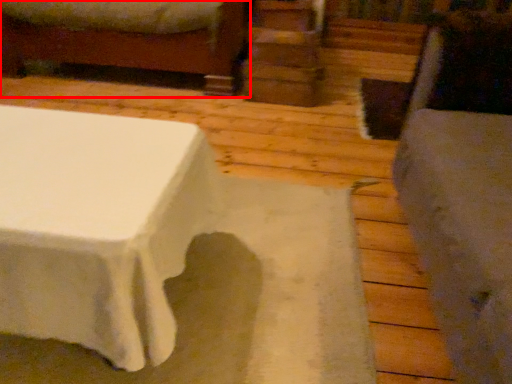
Question: From the image's perspective, where is furniture (annotated by the red box) located relative to swivel chair?

Choices:
 (A) below
 (B) above

Answer: (B)